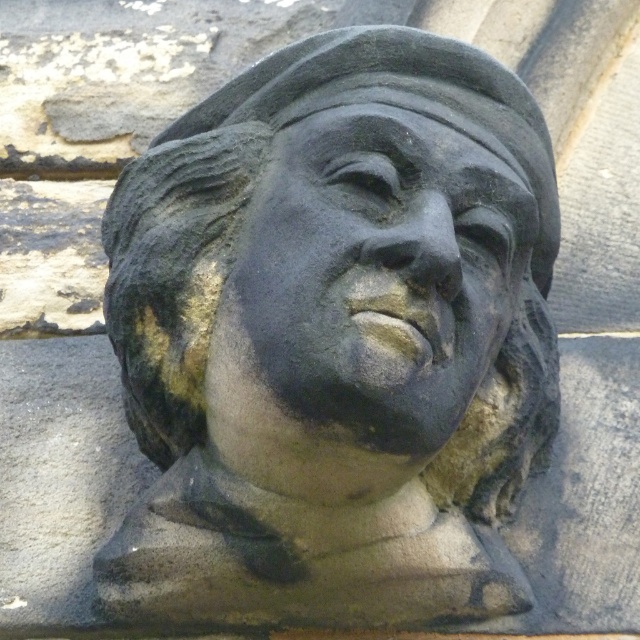
Is black stone bust at center to the left of matte stone face at center from the viewer's perspective?

Indeed, black stone bust at center is positioned on the left side of matte stone face at center.

Is point (500, 243) behind point (333, 388)?

Yes, it is.

Find the location of `black stone bust at center`. black stone bust at center is located at coordinates (333, 339).